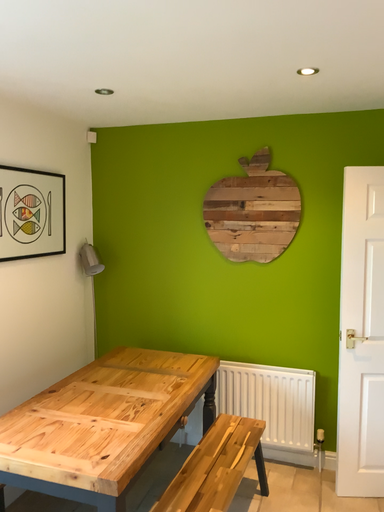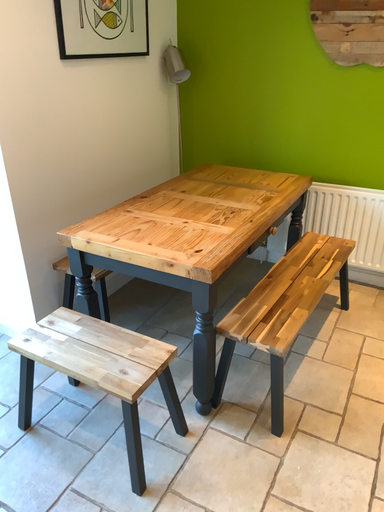
Question: How did the camera likely rotate when shooting the video?

Choices:
 (A) rotated left
 (B) rotated right

Answer: (A)